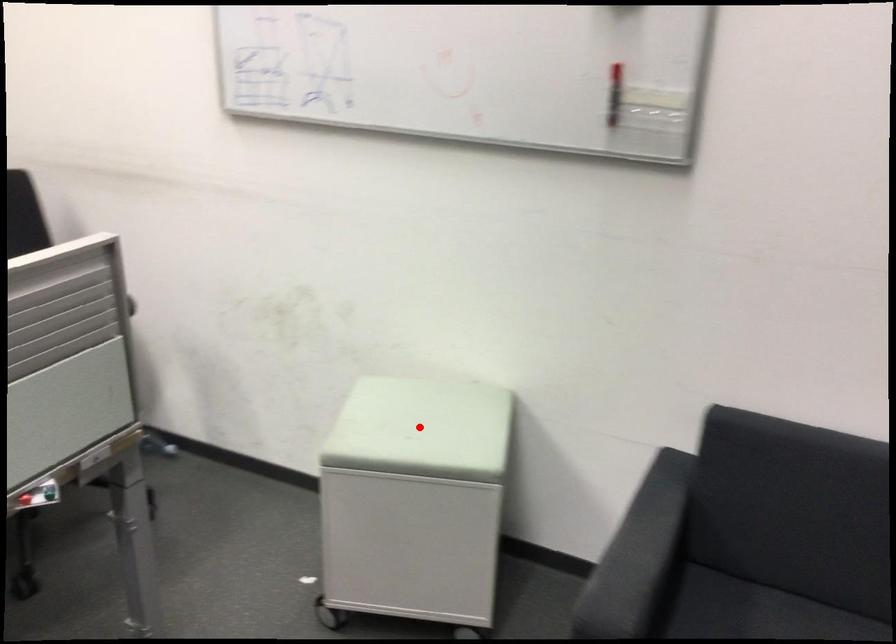
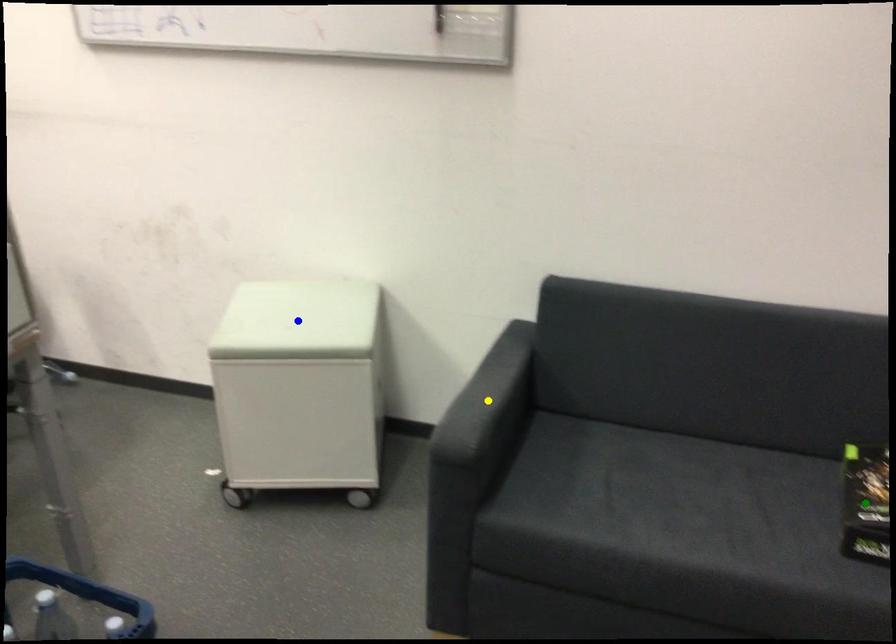
Question: I am providing you with two images of the same scene from different viewpoints. A red point is marked on the first image. You are given multiple points on the second image. In image 2, which mark is for the same physical point as the one in image 1?

Choices:
 (A) blue point
 (B) yellow point
 (C) green point

Answer: (A)